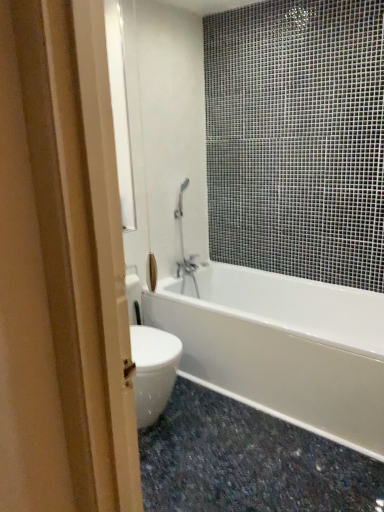
Describe the element at coordinates (282, 347) in the screenshot. The height and width of the screenshot is (512, 384). I see `white glossy bathtub at center` at that location.

Identify the location of white glossy bathtub at center. (282, 347).

Where is `granite at lower right`? granite at lower right is located at coordinates (247, 461).

What do you see at coordinates (247, 461) in the screenshot? I see `granite at lower right` at bounding box center [247, 461].

Where is `white glossy bathtub at center`? The height and width of the screenshot is (512, 384). white glossy bathtub at center is located at coordinates (282, 347).

Which is more to the left, granite at lower right or white glossy bathtub at center?

granite at lower right.

Who is more distant, granite at lower right or white glossy bathtub at center?

white glossy bathtub at center is further from the camera.

Between point (172, 393) and point (284, 343), which one is positioned in front?

Positioned in front is point (284, 343).

From the image's perspective, is granite at lower right above white glossy bathtub at center?

No, from the image's perspective, granite at lower right is not over white glossy bathtub at center.

From a real-world perspective, is granite at lower right positioned under white glossy bathtub at center based on gravity?

Yes, from a real-world perspective, granite at lower right is below white glossy bathtub at center.

Considering the sizes of objects granite at lower right and white glossy bathtub at center in the image provided, who is thinner, granite at lower right or white glossy bathtub at center?

white glossy bathtub at center is thinner.

Does granite at lower right have a lesser height compared to white glossy bathtub at center?

Indeed, granite at lower right has a lesser height compared to white glossy bathtub at center.

Considering the sizes of granite at lower right and white glossy bathtub at center in the image, is granite at lower right bigger or smaller than white glossy bathtub at center?

Clearly, granite at lower right is smaller in size than white glossy bathtub at center.

Looking at this image, is granite at lower right situated inside white glossy bathtub at center or outside?

granite at lower right is outside white glossy bathtub at center.

Are granite at lower right and white glossy bathtub at center making contact?

granite at lower right is not next to white glossy bathtub at center, and they're not touching.

Is granite at lower right positioned with its back to white glossy bathtub at center?

granite at lower right is not turned away from white glossy bathtub at center.

Based on the photo, how different are the orientations of granite at lower right and white glossy bathtub at center in degrees?

The angle between the facing direction of granite at lower right and the facing direction of white glossy bathtub at center is 0.528 degrees.

Find the location of a particular element. The height and width of the screenshot is (512, 384). granite on the left of white glossy bathtub at center is located at coordinates (247, 461).

Visually, is white glossy bathtub at center positioned to the left or to the right of granite at lower right?

From the image, it's evident that white glossy bathtub at center is to the right of granite at lower right.

Is white glossy bathtub at center closer to camera compared to granite at lower right?

No.

Is point (256, 325) farther from viewer compared to point (272, 447)?

Yes, point (256, 325) is farther from viewer.

From the image's perspective, does white glossy bathtub at center appear lower than granite at lower right?

Actually, white glossy bathtub at center appears above granite at lower right in the image.

From a real-world perspective, which object stands above the other?

white glossy bathtub at center.

Is white glossy bathtub at center thinner than granite at lower right?

Indeed, white glossy bathtub at center has a lesser width compared to granite at lower right.

Between white glossy bathtub at center and granite at lower right, which one has more height?

white glossy bathtub at center is taller.

Can you confirm if white glossy bathtub at center is bigger than granite at lower right?

Correct, white glossy bathtub at center is larger in size than granite at lower right.

Is white glossy bathtub at center situated inside granite at lower right or outside?

The correct answer is: outside.

Is white glossy bathtub at center placed right next to granite at lower right?

white glossy bathtub at center is not next to granite at lower right, and they're not touching.

Is white glossy bathtub at center aimed at granite at lower right?

Yes, white glossy bathtub at center is facing granite at lower right.

Can you tell me how much white glossy bathtub at center and granite at lower right differ in facing direction?

white glossy bathtub at center and granite at lower right are facing 0.528 degrees away from each other.

Where is `bathtub to the right of granite at lower right`? The height and width of the screenshot is (512, 384). bathtub to the right of granite at lower right is located at coordinates (282, 347).

You are a GUI agent. You are given a task and a screenshot of the screen. Output one action in this format:
    pyautogui.click(x=<x>, y=<y>)
    Task: Click on the bathtub located above the granite at lower right (from the image's perspective)
    
    Given the screenshot: What is the action you would take?
    pyautogui.click(x=282, y=347)

In the image, there is a white glossy bathtub at center. Where is `granite below it (from a real-world perspective)`? granite below it (from a real-world perspective) is located at coordinates (247, 461).